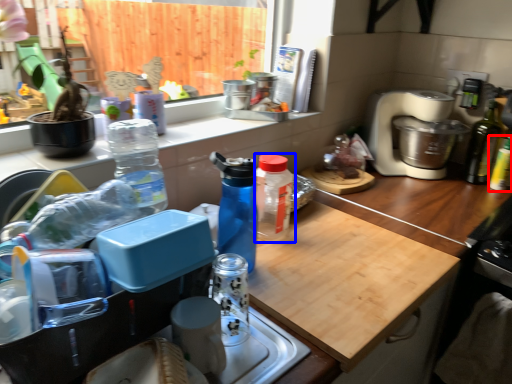
Question: Which point is closer to the camera, bottle (highlighted by a red box) or bottle (highlighted by a blue box)?

Choices:
 (A) bottle
 (B) bottle

Answer: (B)